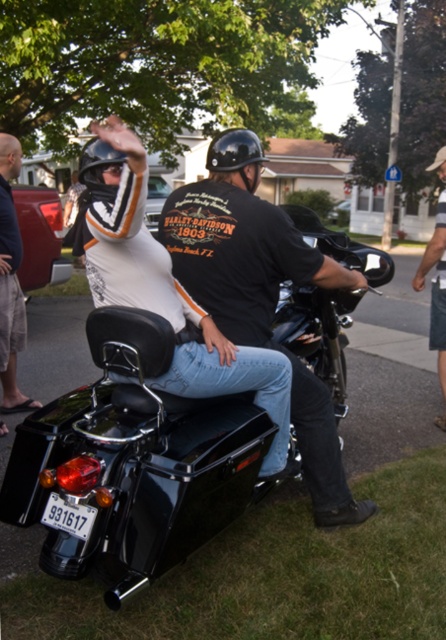
You are a photographer trying to capture a photo of the black glossy motorcycle at center and the denim shorts at lower right. Which object should you focus on first if you want to ensure both are in focus, considering their heights?

The black glossy motorcycle at center has a lesser height compared to denim shorts at lower right. To ensure both are in focus, you should focus on the denim shorts at lower right first since it is taller and closer to the camera.

You are a delivery person who needs to place a helmet on a motorcycle. The motorcycle has a limited space of 30 inches between its handlebars and the seat. Given that the black matte helmet at center and black matte motorcycle at center are 30.25 inches apart, will the helmet fit within the motorcycle space?

The black matte helmet at center and black matte motorcycle at center are 30.25 inches apart, which exceeds the motorcycle space of 30 inches. Therefore, the helmet will not fit within the designated area.